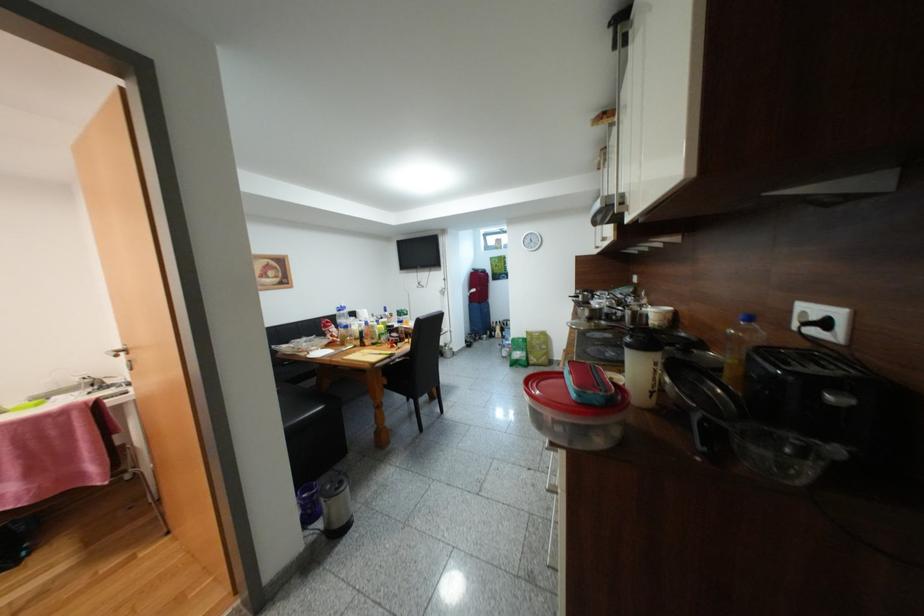
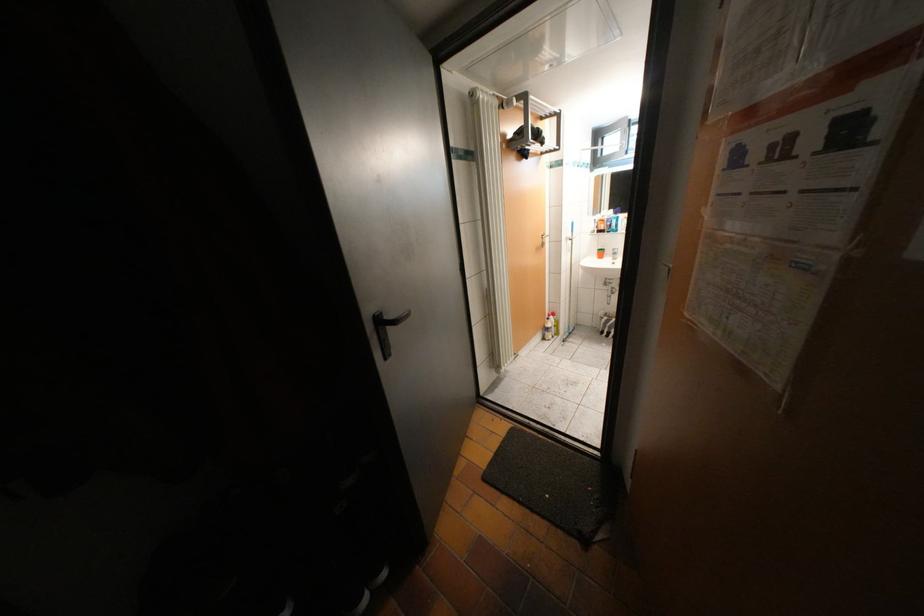
Based on the photo, the images are taken continuously from a first-person perspective. In which direction are you moving?

The cameraman walked toward right, backward.